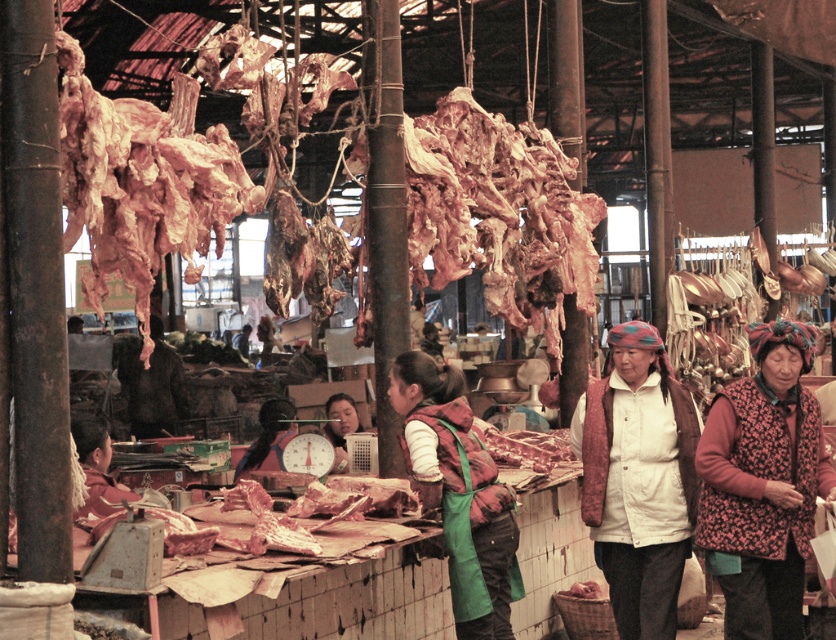
You are a customer at the meat market and want to approach both the green apron at center and the matte pink apron at center. Which apron should you head towards first to reach the one closer to you?

You should head towards the green apron at center first because it is closer to you than the matte pink apron at center.